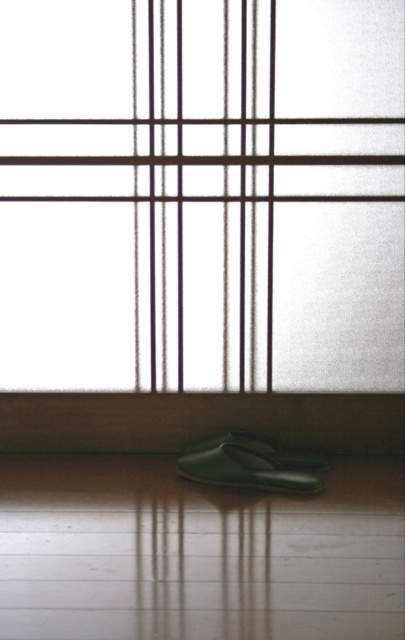
You are standing in a room with a traditional Japanese shoji screen in the background. You notice a frosted glass window at center and a green matte shoe at lower center. Which object is located higher up in the scene?

The frosted glass window at center is located higher up in the scene than the green matte shoe at lower center.

Looking at this image, you are standing in a room with a frosted glass window at center and a green matte slipper at lower center. Which object is taller?

The frosted glass window at center is taller than the green matte slipper at lower center according to the description.

You are standing in a room with a traditional Japanese shoji screen. You see a frosted glass window at center and a green matte shoe at lower center. Which object is positioned to the left of the other?

The frosted glass window at center is to the left of the green matte shoe at lower center.